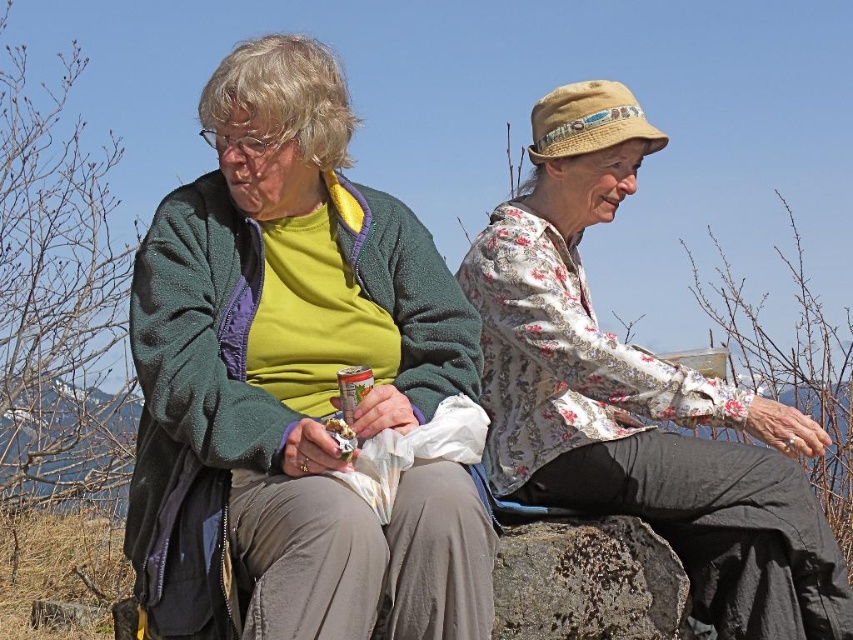
Which of these two, floral fabric blouse at upper right or rusty stone boulder at center, stands shorter?

With less height is rusty stone boulder at center.

Is floral fabric blouse at upper right smaller than rusty stone boulder at center?

Actually, floral fabric blouse at upper right might be larger than rusty stone boulder at center.

Between point (784, 509) and point (635, 620), which one is positioned in front?

Positioned in front is point (635, 620).

This screenshot has width=853, height=640. What are the coordinates of `floral fabric blouse at upper right` in the screenshot? It's located at (637, 396).